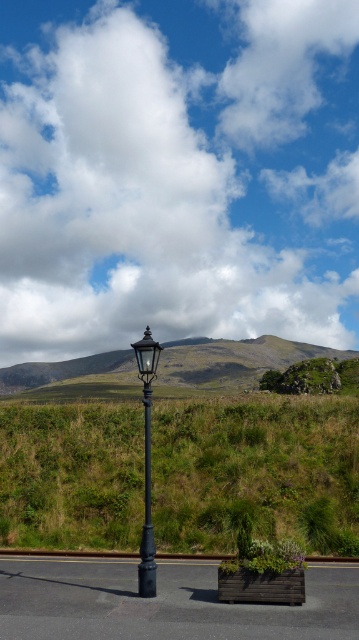
You are standing at the base of the classic street lamp in the scene. Looking around, you notice a point marked at coordinates (234, 360). What does this point represent in the scene?

The point at coordinates (234, 360) corresponds to the green grassy hillside at center.

You are a gardener who needs to water the green grassy at center and the black metal pole at center. You have a hose that can reach 8 feet. Can you water both areas without moving the hose? Please explain your reasoning.

The distance between the green grassy at center and the black metal pole at center is 8.54 feet. Since the hose can only reach 8 feet, it is not long enough to cover the entire distance between them. Therefore, you would need to move the hose to water both areas.

You are standing at the point with coordinates 0.5, 0.5 in the image. You want to walk to the green grassy at center. In which direction should you move?

The green grassy at center is located at point (255,472). Since your current position is at (179,320), you should move northeast to reach it.